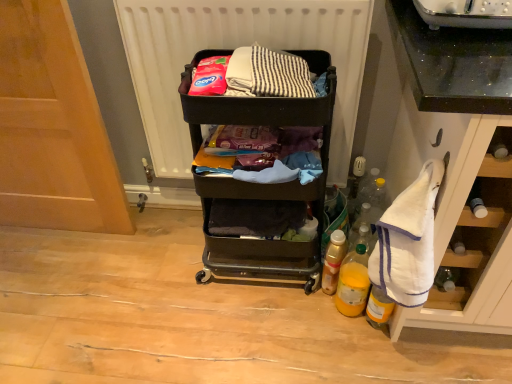
The height and width of the screenshot is (384, 512). I want to click on vacant space that is to the left of yellow translucent bottle at lower right, arranged as the 3th bottle when viewed from the left, so click(325, 330).